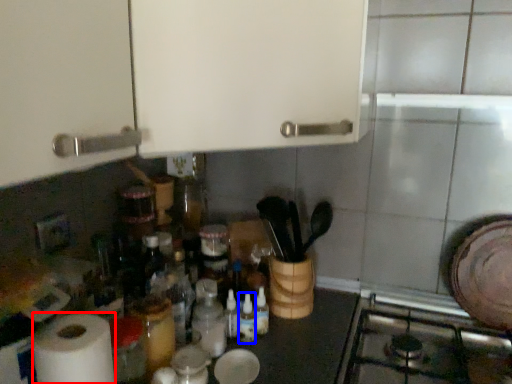
Question: Which object appears closest to the camera in this image, paper towel (highlighted by a red box) or bottle (highlighted by a blue box)?

Choices:
 (A) paper towel
 (B) bottle

Answer: (A)